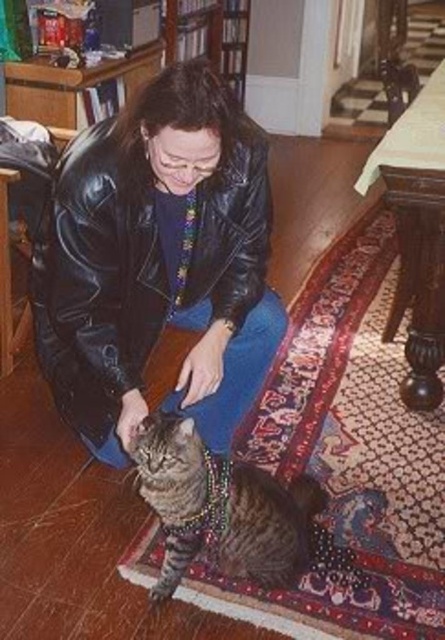
You are a photographer trying to capture a closeup of the tabby fur cat at center. The black leather jacket at center is blocking your view. Can you estimate whether the cat is smaller than the jacket, so you can adjust your camera angle accordingly?

The black leather jacket at center is bigger than the tabby fur cat at center, so the cat is smaller. Adjust your camera angle to move around the jacket to get a clear shot of the cat.

You are a photographer trying to capture the cat in the image. Since the black leather jacket at center is covering part of the tabby fur cat at center, can you still see the cat?

The black leather jacket at center is positioned over the tabby fur cat at center, so part of the cat is covered. However, since the jacket is placed over the cat, some parts of the tabby fur cat at center are still visible.

You are a photographer trying to capture a clear photo of the tabby fur cat at center without the black leather jacket at center blocking the view. Based on their positions, is this possible?

The black leather jacket at center is further to the viewer than the tabby fur cat at center, so the jacket is closer to you. This means the jacket would block the view of the cat, making it difficult to take a clear photo without moving either the jacket or the cat.